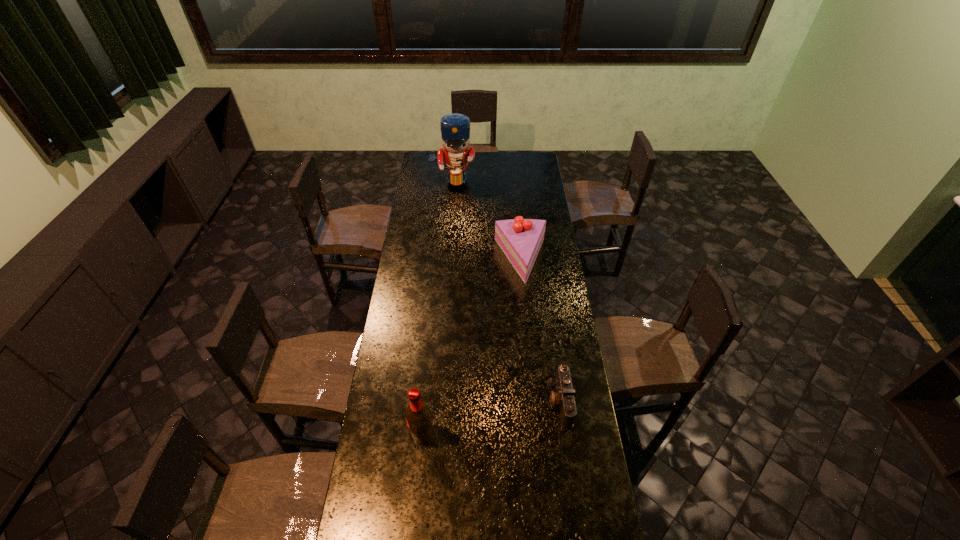
Locate an element on the screen. nutcracker is located at coordinates (455, 128).

Identify the location of the farthest object. The height and width of the screenshot is (540, 960). (455, 128).

Find the location of `the second tallest object`. the second tallest object is located at coordinates (418, 416).

Locate an element on the screen. the third nearest object is located at coordinates (520, 239).

Find the location of a particular element. This screenshot has width=960, height=540. cake is located at coordinates (520, 239).

At what (x,y) coordinates should I click in order to perform the action: click on camera. Please return your answer as a coordinate pair (x, y). The height and width of the screenshot is (540, 960). Looking at the image, I should click on (564, 398).

Where is `vacant space located 0.290m on the front-facing side of the tallest object`? The height and width of the screenshot is (540, 960). vacant space located 0.290m on the front-facing side of the tallest object is located at coordinates (449, 222).

Locate an element on the screen. free space located on the left of the beer bottle is located at coordinates (396, 434).

What are the coordinates of `vacant space located 0.350m on the front of the cake` in the screenshot? It's located at (529, 346).

Locate an element on the screen. The width and height of the screenshot is (960, 540). vacant region located 0.300m on the front-facing side of the shortest object is located at coordinates (468, 402).